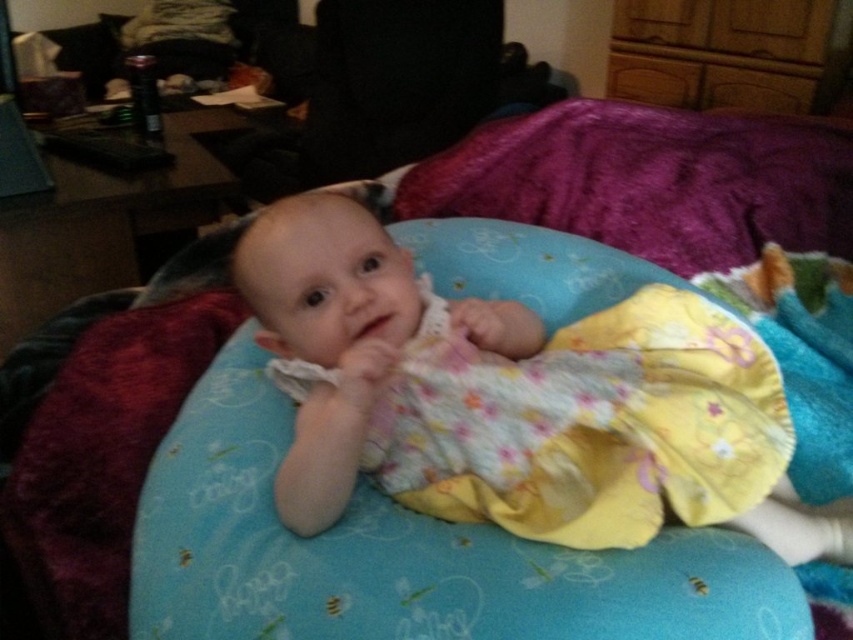
The image size is (853, 640). What are the coordinates of `yellow floral dress at center` in the screenshot? It's located at (515, 400).

Can you confirm if yellow floral dress at center is thinner than purple plush blanket at upper center?

Correct, yellow floral dress at center's width is less than purple plush blanket at upper center's.

Between point (674, 348) and point (552, 188), which one is positioned in front?

Point (674, 348) is in front.

Locate an element on the screen. This screenshot has width=853, height=640. yellow floral dress at center is located at coordinates (515, 400).